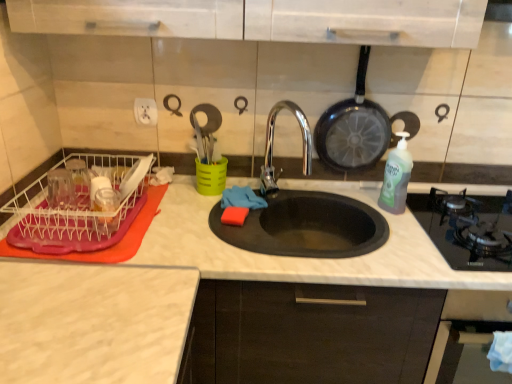
Locate an element on the screen. vacant space positioned to the left of green translucent bottle at right is located at coordinates (352, 205).